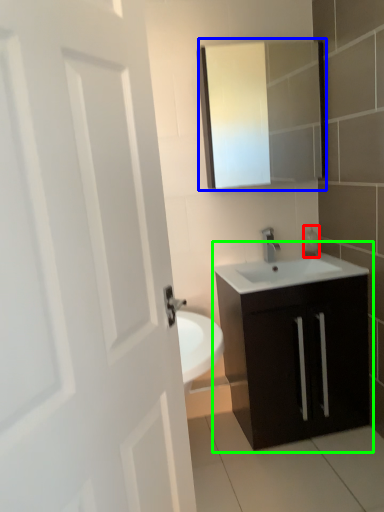
Question: Which is farther away from soap dispenser (highlighted by a red box)? medicine cabinet (highlighted by a blue box) or bathroom cabinet (highlighted by a green box)?

Choices:
 (A) medicine cabinet
 (B) bathroom cabinet

Answer: (A)